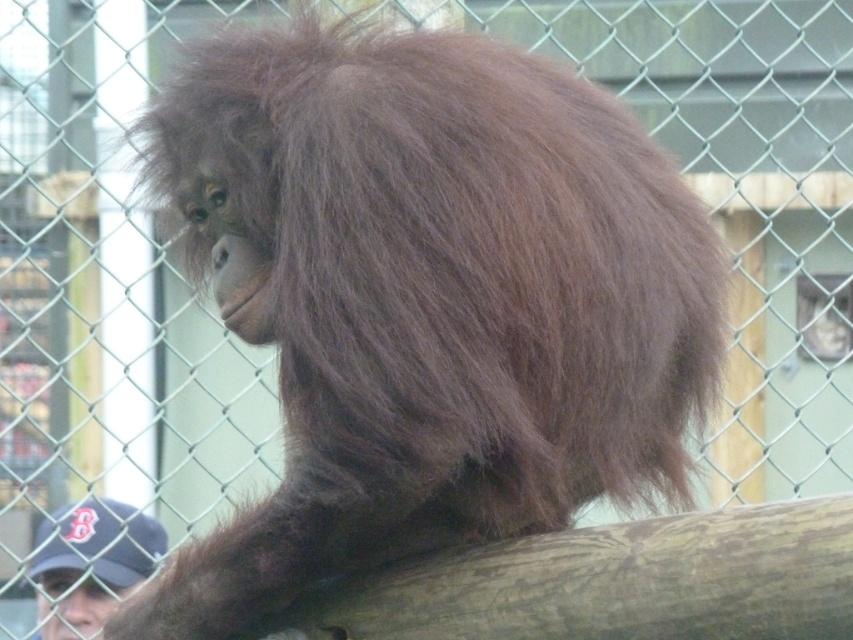
You are standing at the zoo enclosure and want to feed the brown furry orangutan at center with a banana. The zoo rules state that you must stay at least 5 feet away from any animal. Are you within the safe distance according to the rules?

The brown furry orangutan at center is 6.29 feet away from the viewer. Since the required safe distance is 5 feet, you are within the safe distance as 6.29 feet is greater than 5 feet.

You are a zookeeper standing at the center of the enclosure. You need to place a banana at the exact center of the enclosure to attract the brown furry orangutan at center. Will the banana be placed directly in front of the orangutan?

The brown furry orangutan at center is located at point [427,300], which is very close to the center of the enclosure. Placing the banana at the exact center would position it directly in front of the orangutan.